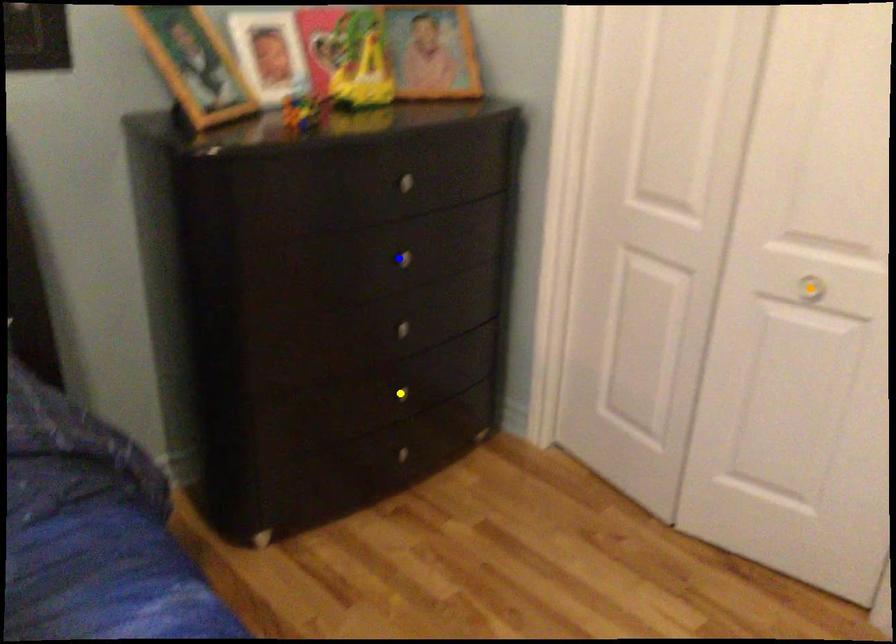
Order these from nearest to farthest:
orange point, blue point, yellow point

orange point
blue point
yellow point